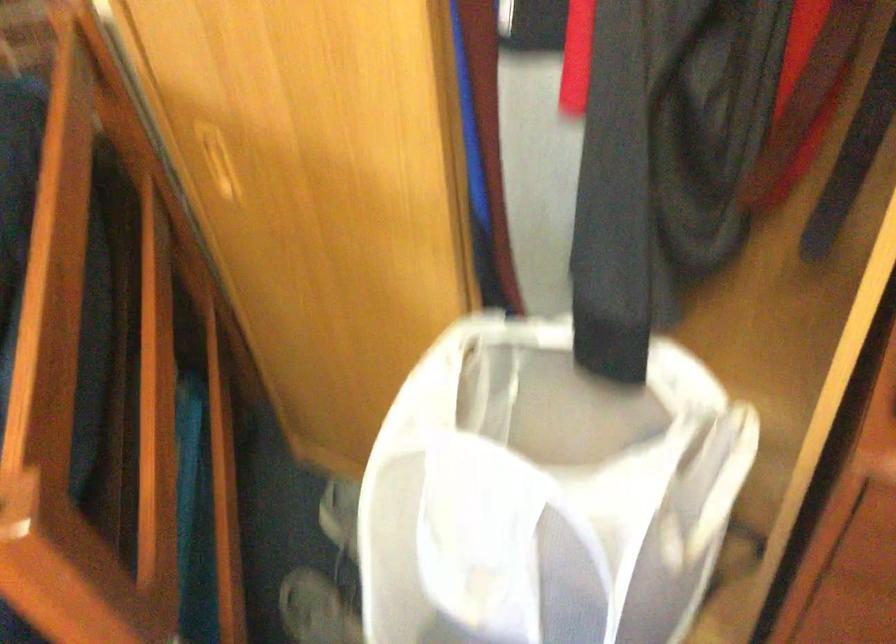
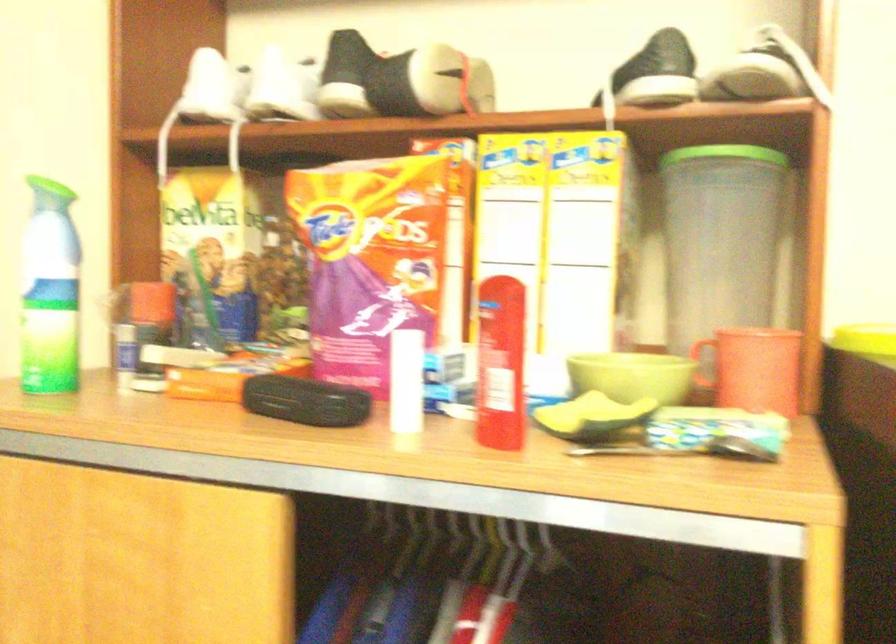
The images are taken continuously from a first-person perspective. In which direction is your viewpoint rotating?

The camera's rotation is toward right-up.